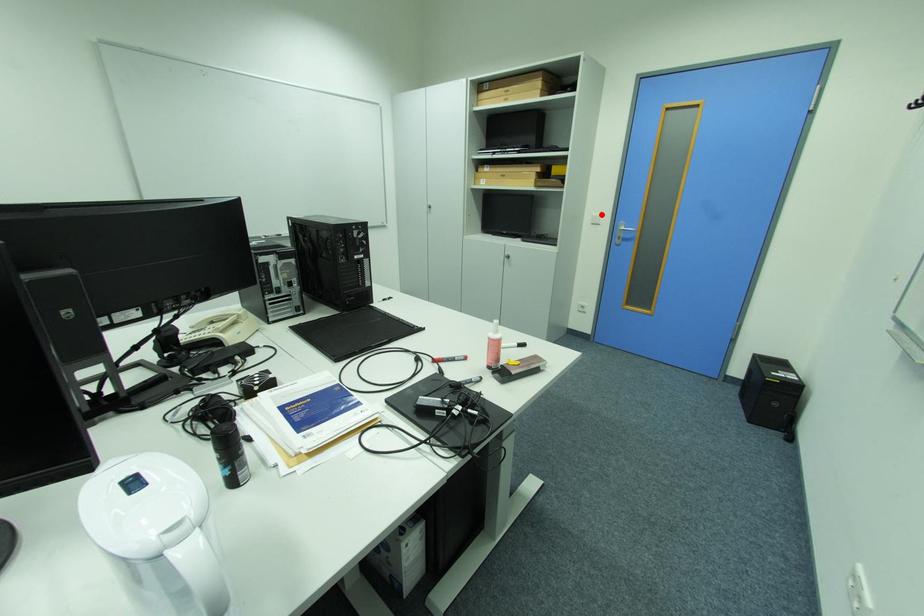
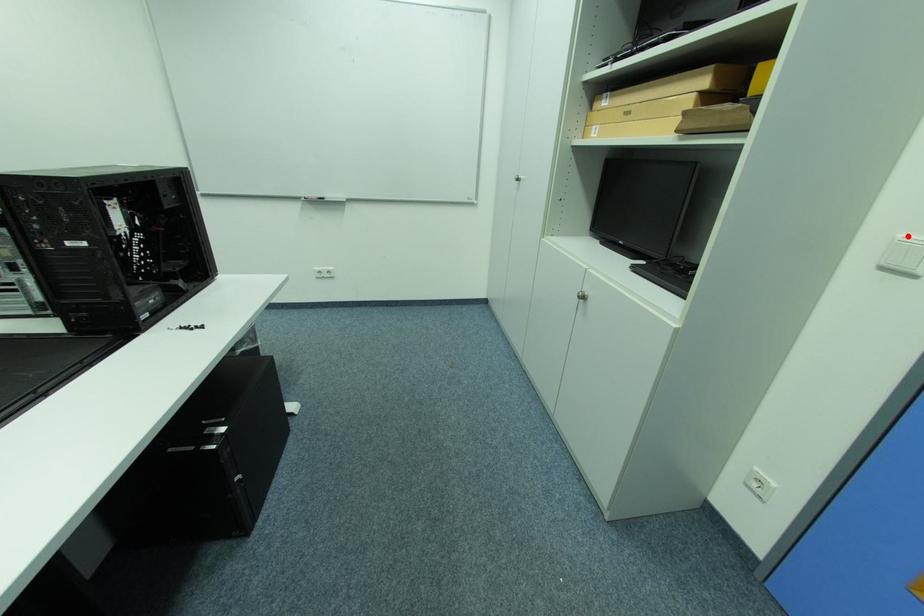
I am providing you with two images of the same scene from different viewpoints. A red point is marked on the first image and another point is marked on the second image. Is the red point in image1 aligned with the point shown in image2?

Yes